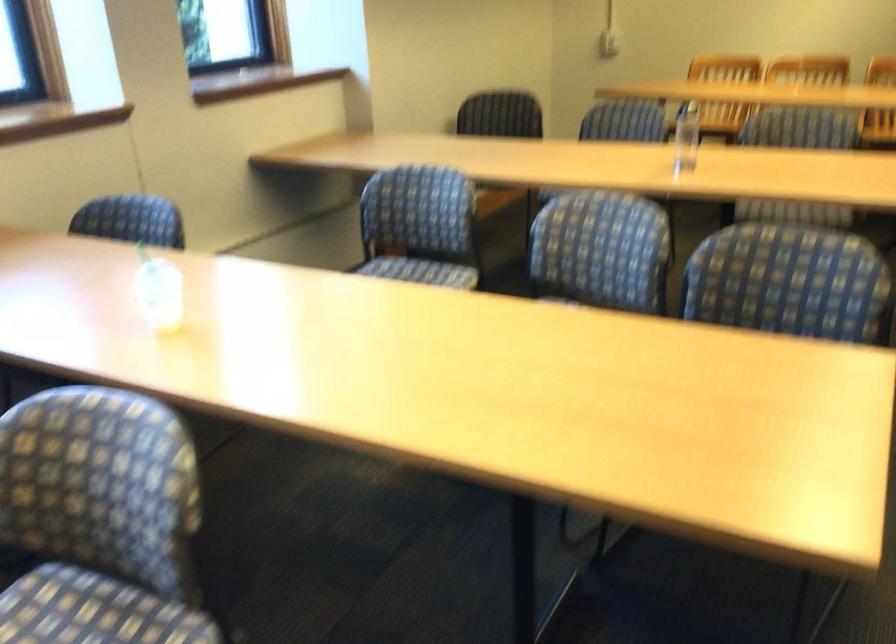
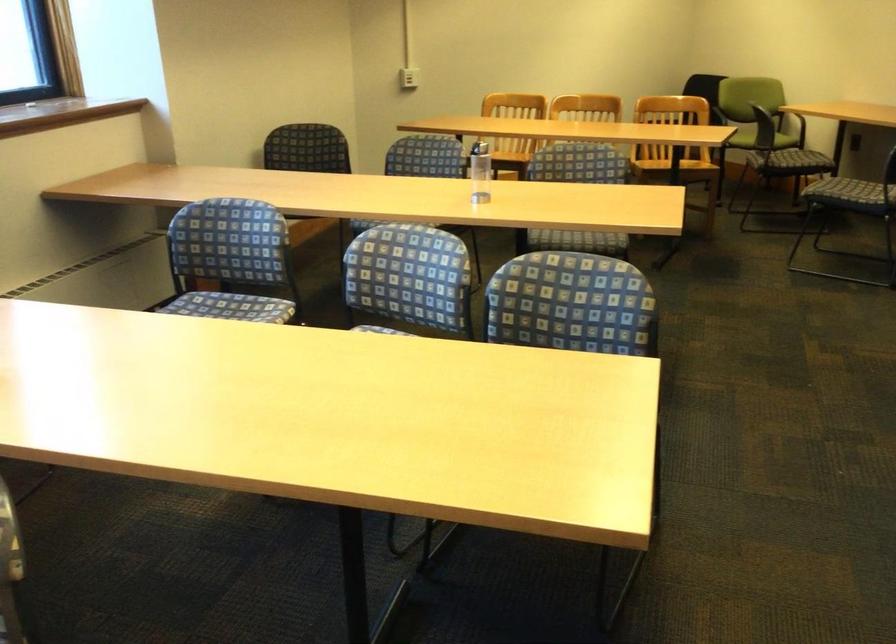
Question: Based on the continuous images, in which direction is the camera rotating? Reply with the corresponding letter.

Choices:
 (A) Left
 (B) Right
 (C) Up
 (D) Down

Answer: (B)